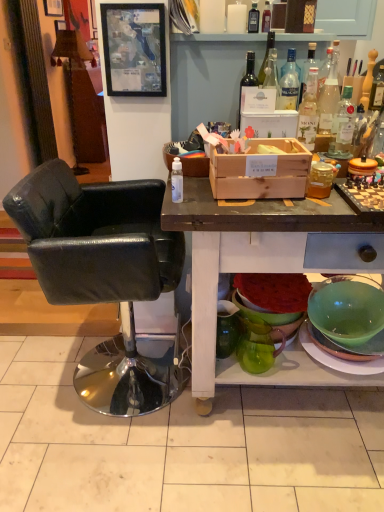
Question: Considering the relative positions of wooden crate at center and green glass pitcher at lower center, the first pitcher when ordered from left to right, in the image provided, is wooden crate at center to the left or to the right of green glass pitcher at lower center, the first pitcher when ordered from left to right,?

Choices:
 (A) right
 (B) left

Answer: (A)

Question: Considering the positions of wooden crate at center and green glass pitcher at lower center, the second pitcher viewed from the right, in the image, is wooden crate at center bigger or smaller than green glass pitcher at lower center, the second pitcher viewed from the right,?

Choices:
 (A) small
 (B) big

Answer: (B)

Question: Based on their relative distances, which object is nearer to the wooden textured lamp at upper left?

Choices:
 (A) wooden crate at center
 (B) clear glass bottle at upper right, the 8th bottle when ordered from left to right
 (C) clear glass bottle at upper right, the eighth bottle positioned from the back
 (D) clear glass bottle at upper right, which appears as the 4th bottle when viewed from the right
 (E) clear glass bottle at upper right, which ranks as the fourth bottle in back-to-front order

Answer: (C)

Question: Which object is positioned closest to the matte glass wine bottle at upper center, which is counted as the 2th bottle, starting from the left?

Choices:
 (A) green glass pitcher at lower center, the first pitcher in the right-to-left sequence
 (B) clear glass bottle at upper right, the second bottle in the right-to-left sequence
 (C) wooden knife block at upper right, the ninth bottle when ordered from left to right
 (D) green glass pitcher at lower center, the first pitcher when ordered from left to right
 (E) wooden crate at center

Answer: (B)